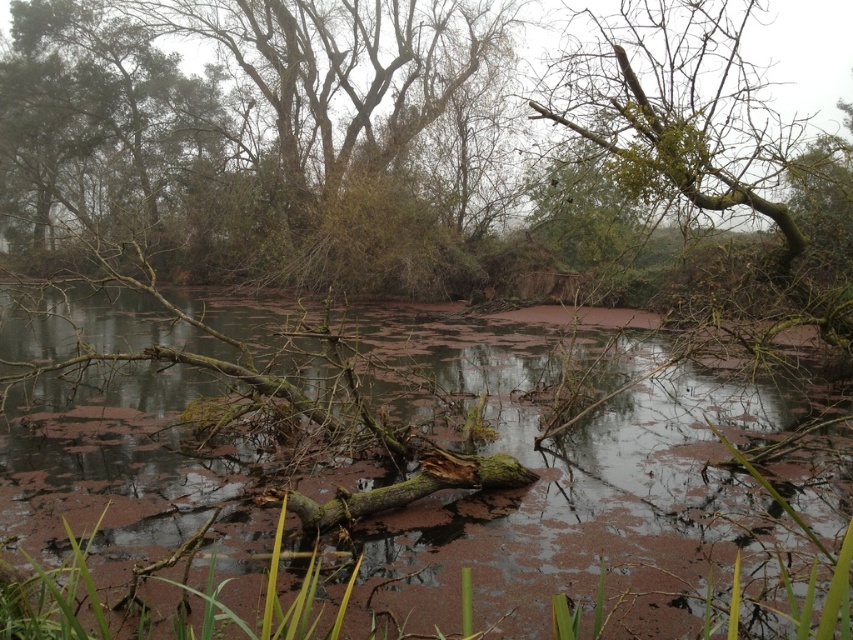
What are the coordinates of `brown mossy log at center` in the screenshot? It's located at (379, 476).